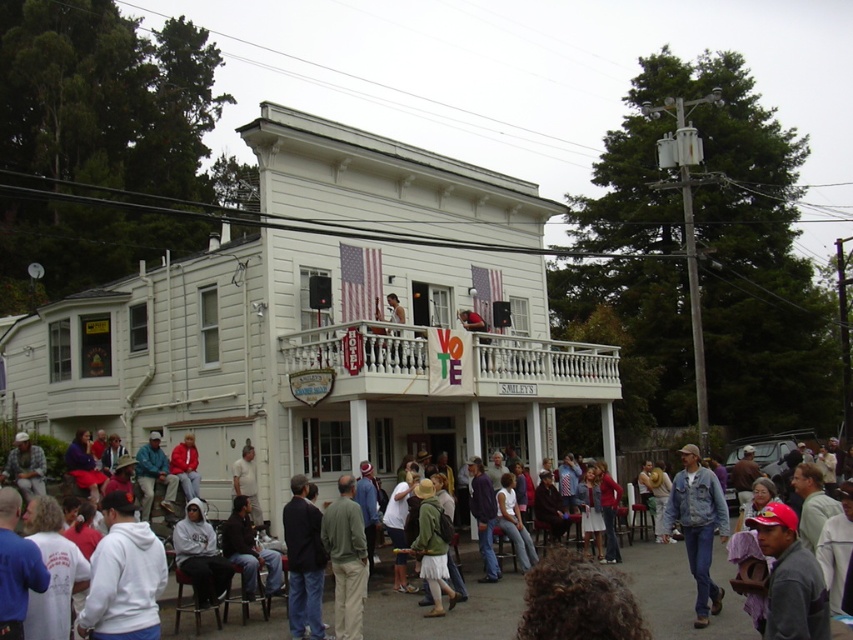
You are an architect analyzing the building structure. You notice the white painted wood at upper center and the denim jacket at center. Which object has a smaller width?

The white painted wood at upper center is thinner than the denim jacket at center, so the white painted wood at upper center has a smaller width.

You are an architect analyzing the building structure. You notice the white painted wood at upper center and the denim jacket at center. Which object is shorter in height?

The white painted wood at upper center is shorter in height than the denim jacket at center.

You are attending an event at the building and notice the red cap at lower right and the green fabric jacket at center. Which object is taller?

The red cap at lower right is much taller than the green fabric jacket at center.